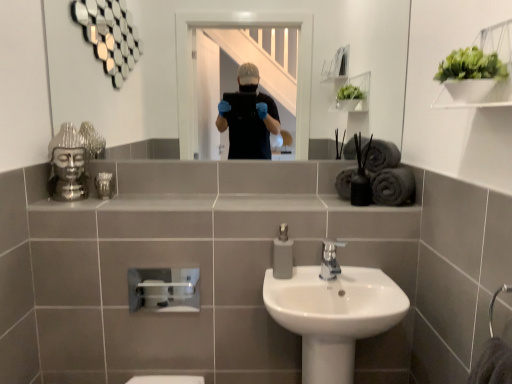
Locate an element on the screen. This screenshot has width=512, height=384. vacant space that's between metallic glass at upper left and dark gray matte bath towel at right, the second bath towel when ordered from top to bottom is located at coordinates coord(230,193).